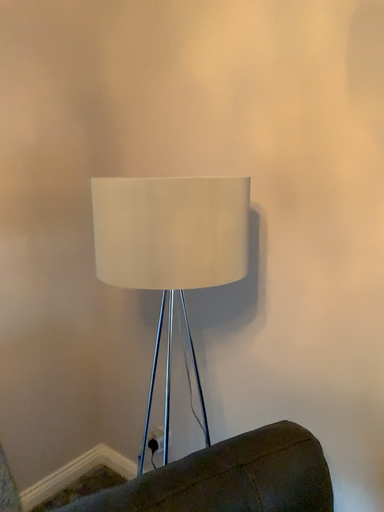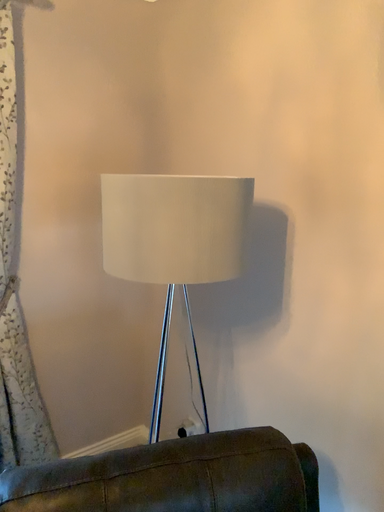
Question: How did the camera likely rotate when shooting the video?

Choices:
 (A) rotated left
 (B) rotated right

Answer: (A)